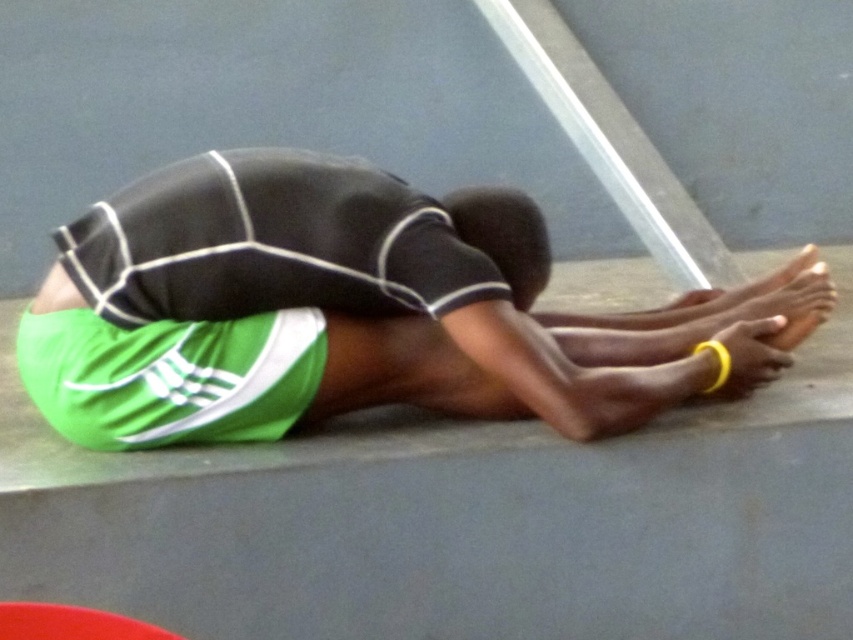
You are a fitness instructor preparing for a class. You notice two pairs of green fabric shorts at center and green fabric shorts at lower left in the image. Which pair is wider?

The green fabric shorts at center is wider than the green fabric shorts at lower left.

You are an athlete preparing for a competition and you see the green fabric shorts at center and the green fabric shorts at lower left in the image. Which pair of shorts is closer to the camera?

The green fabric shorts at center is taller than green fabric shorts at lower left, so the green fabric shorts at center is closer to the camera.

You are an athlete preparing for a competition and you see the green fabric shorts at center and the green fabric shorts at lower left in the image. Which pair of shorts is positioned more to the right side of the image?

The green fabric shorts at center is positioned more to the right side of the image compared to the green fabric shorts at lower left.